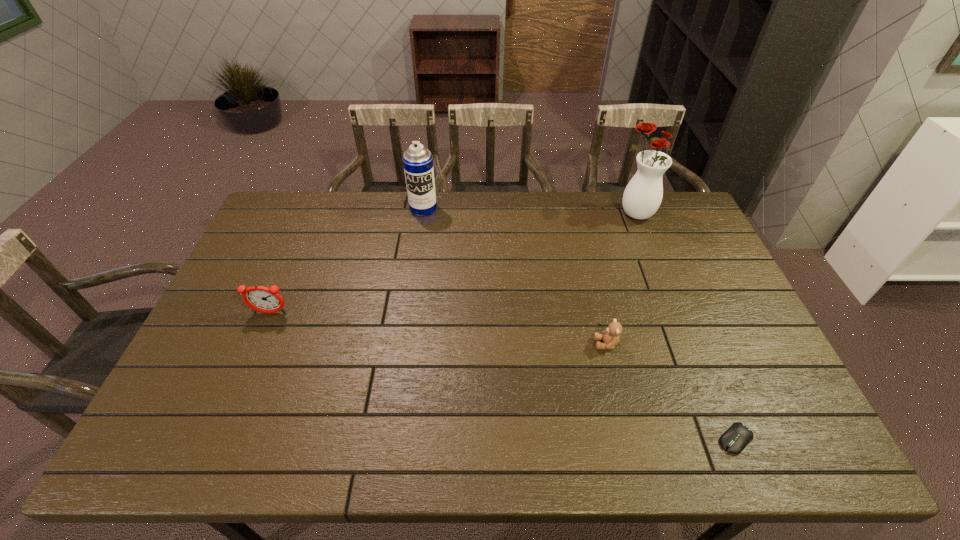
The width and height of the screenshot is (960, 540). I want to click on vase at the right edge, so click(642, 197).

Locate an element on the screen. The height and width of the screenshot is (540, 960). computer equipment located at the right edge is located at coordinates (736, 438).

You are a GUI agent. You are given a task and a screenshot of the screen. Output one action in this format:
    pyautogui.click(x=<x>, y=<y>)
    Task: Click on the object present at the far right corner
    The width and height of the screenshot is (960, 540).
    Given the screenshot: What is the action you would take?
    pyautogui.click(x=642, y=197)

This screenshot has height=540, width=960. I want to click on object located in the near right corner section of the desktop, so click(x=736, y=438).

In the image, there is a desktop. Where is `vacant space at the far edge`? This screenshot has width=960, height=540. vacant space at the far edge is located at coordinates coord(454,232).

Identify the location of blank space at the near edge of the desktop. The height and width of the screenshot is (540, 960). (268, 449).

Find the location of a particular element. Image resolution: width=960 pixels, height=540 pixels. free space at the left edge of the desktop is located at coordinates (164, 415).

In the image, there is a desktop. Identify the location of vacant space at the right edge. Image resolution: width=960 pixels, height=540 pixels. (708, 283).

This screenshot has height=540, width=960. What are the coordinates of `vacant space at the near left corner of the desktop` in the screenshot? It's located at (152, 458).

In order to click on free spot between the second tallest object and the shortest object in this screenshot , I will do `click(580, 324)`.